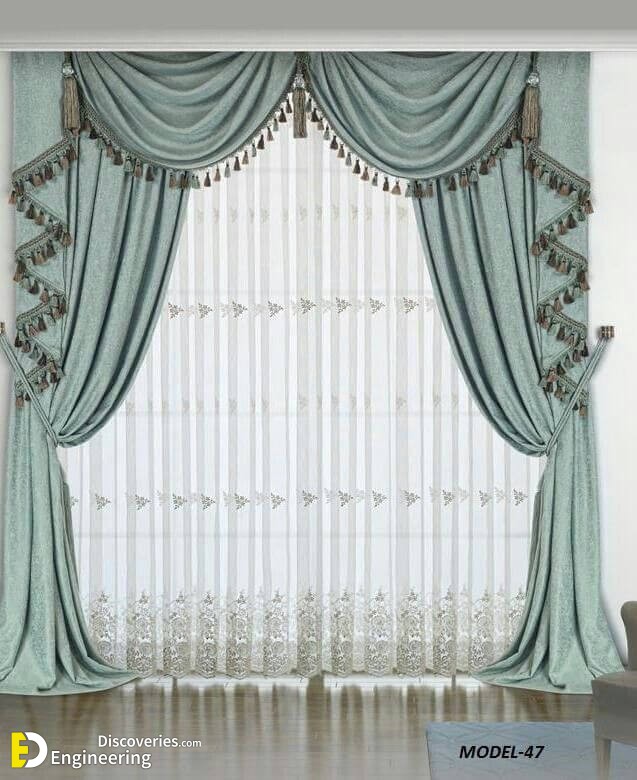
Where is `wood floor`? wood floor is located at coordinates click(227, 746).